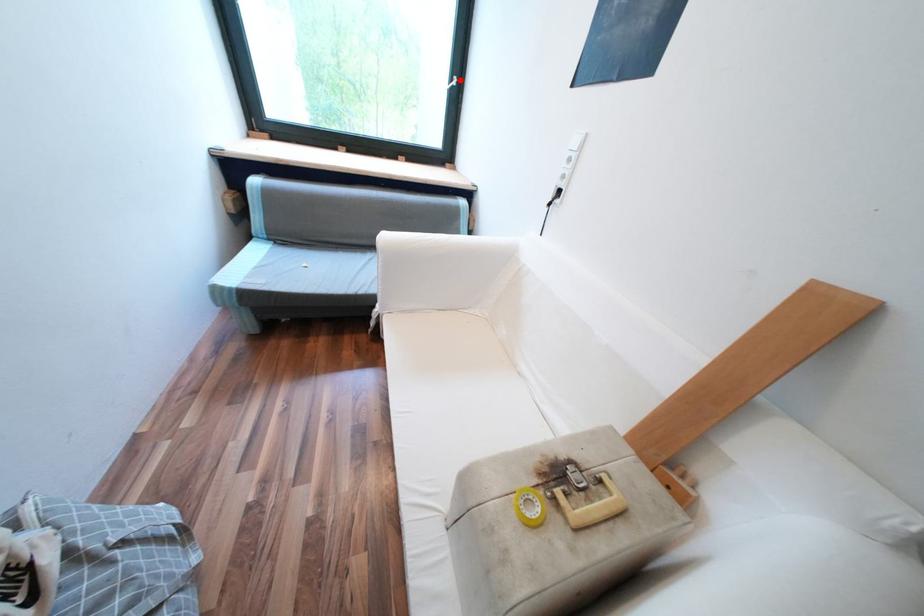
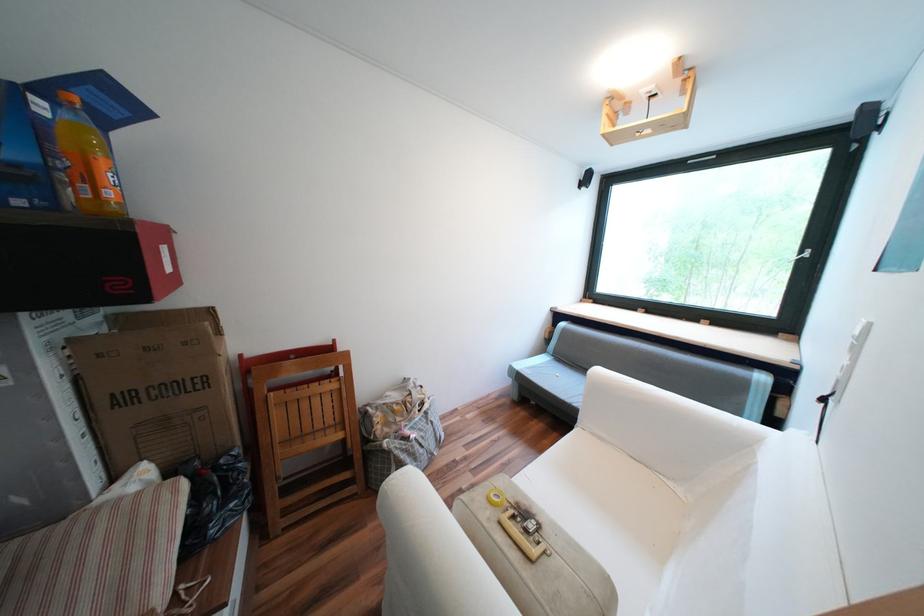
Find the pixel in the second image that matches the highlighted location in the first image.

(809, 253)